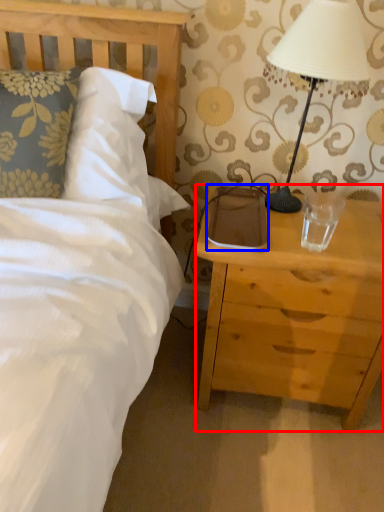
Question: Which object is closer to the camera taking this photo, nightstand (highlighted by a red box) or pad (highlighted by a blue box)?

Choices:
 (A) nightstand
 (B) pad

Answer: (A)